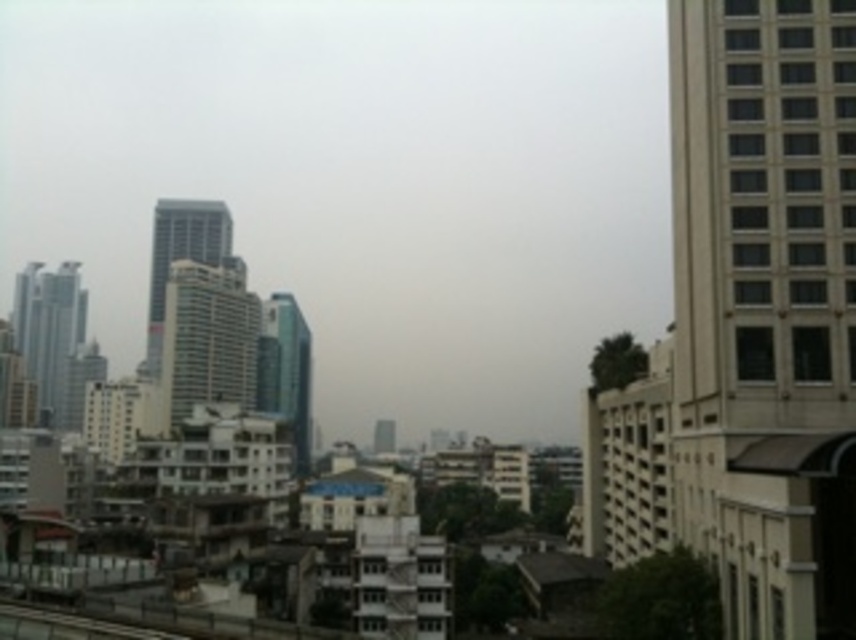
Does beige smooth building at right have a greater width compared to glassy steel skyscraper at left?

Incorrect, beige smooth building at right's width does not surpass glassy steel skyscraper at left's.

Is point (807, 241) farther from viewer compared to point (52, 324)?

That is False.

Find the location of a particular element. This screenshot has width=856, height=640. beige smooth building at right is located at coordinates (765, 307).

Can you confirm if glassy steel skyscraper at left is bigger than glassy teal skyscraper at center?

Correct, glassy steel skyscraper at left is larger in size than glassy teal skyscraper at center.

Can you confirm if glassy steel skyscraper at left is wider than glassy teal skyscraper at center?

Indeed, glassy steel skyscraper at left has a greater width compared to glassy teal skyscraper at center.

The width and height of the screenshot is (856, 640). Find the location of `glassy steel skyscraper at left`. glassy steel skyscraper at left is located at coordinates (49, 330).

Identify the location of glassy steel skyscraper at left. This screenshot has height=640, width=856. (49, 330).

How distant is glassy steel skyscraper at left from glassy blue skyscraper at center-left?

glassy steel skyscraper at left and glassy blue skyscraper at center-left are 58.55 meters apart.

Between point (78, 304) and point (168, 227), which one is positioned in front?

Point (168, 227)

Identify the location of glassy steel skyscraper at left. The width and height of the screenshot is (856, 640). (49, 330).